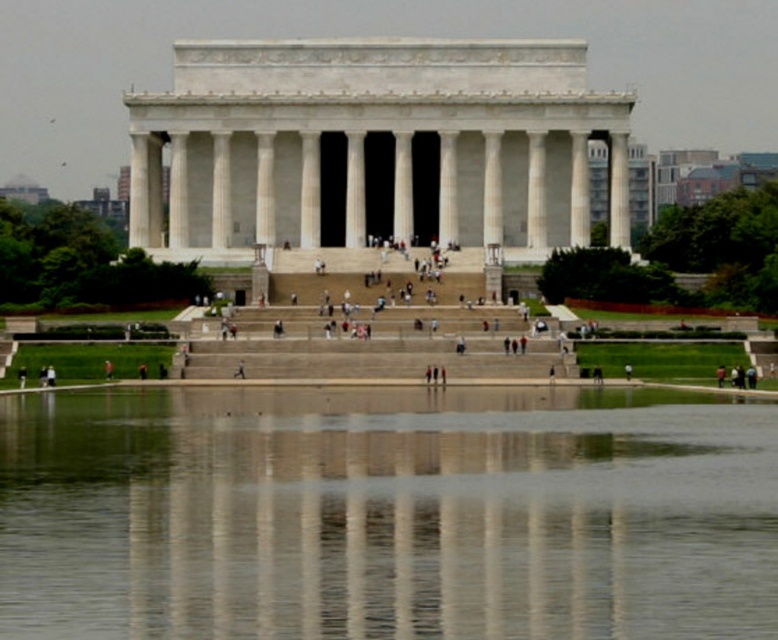
You are standing in front of the Lincoln Memorial and want to get a drink of water. You see the clear glass water at center and the white stone stairs at center. Which object is closer to you?

The clear glass water at center is closer to the viewer than the white stone stairs at center, so you can reach it first before the stairs.

You are standing at the base of the Lincoln Memorial steps and want to take a photo of the white marble column at center while also capturing the white stone stairs at center in the frame. Based on their positions, which object should be placed to the right in your photo composition?

The white marble column at center is positioned on the right side of the white stone stairs at center, so in your photo composition, the white marble column at center should be placed to the right of the white stone stairs at center.

You are standing at the Lincoln Memorial and want to take a photo. There are two points marked in the image. The first point is at coordinates point (x=554, y=435) and the second point is at point (x=395, y=204). Which point is closer to the entrance of the Lincoln Memorial?

Point (x=554, y=435) is in front of point (x=395, y=204), so it is closer to the entrance of the Lincoln Memorial.